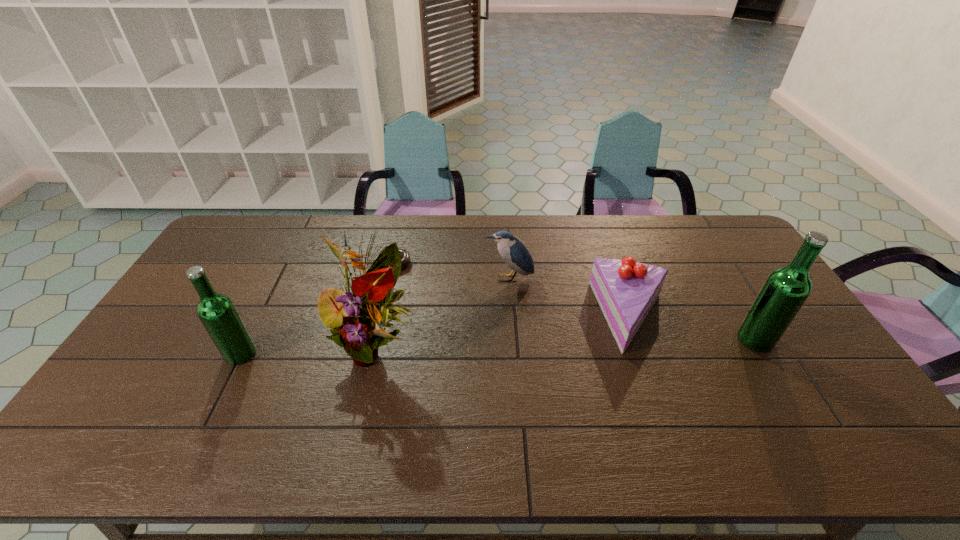
Image resolution: width=960 pixels, height=540 pixels. Identify the location of vacant region between the cake and the rightmost object. (694, 328).

Find the location of a particular element. The width and height of the screenshot is (960, 540). vacant area between the fifth object from left to right and the leftmost object is located at coordinates (437, 335).

The image size is (960, 540). Identify the location of free spot between the bouquet and the fifth object from left to right. (505, 331).

Identify the location of free space between the bouquet and the taller beer bottle. (566, 343).

The height and width of the screenshot is (540, 960). In order to click on empty space between the bouquet and the cake in this screenshot , I will do `click(505, 331)`.

At what (x,y) coordinates should I click in order to perform the action: click on free spot between the bird and the bouquet. Please return your answer as a coordinate pair (x, y). Looking at the image, I should click on (443, 312).

The width and height of the screenshot is (960, 540). I want to click on free point between the fifth tallest object and the left beer bottle, so click(437, 335).

Locate which object is the third closest to the rightmost object. Please provide its 2D coordinates. Your answer should be formatted as a tuple, i.e. [(x, y)], where the tuple contains the x and y coordinates of a point satisfying the conditions above.

[(356, 326)]

This screenshot has width=960, height=540. I want to click on object that is the fifth closest one to the bird, so click(218, 314).

The image size is (960, 540). In order to click on free location that satisfies the following two spatial constraints: 1. on the front side of the right beer bottle; 2. on the right side of the second object from right to left in this screenshot , I will do `click(641, 340)`.